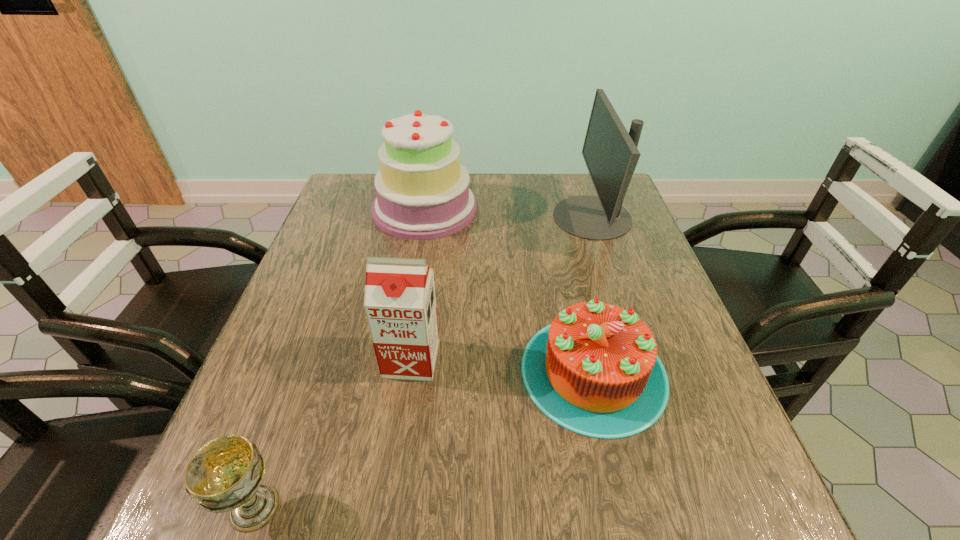
Identify the location of computer monitor. (610, 153).

Locate an element on the screen. The width and height of the screenshot is (960, 540). the farther cake is located at coordinates (422, 190).

At what (x,y) coordinates should I click in order to perform the action: click on the left cake. Please return your answer as a coordinate pair (x, y). Looking at the image, I should click on (422, 190).

I want to click on soya milk, so click(x=400, y=304).

Where is `the right cake`? the right cake is located at coordinates (594, 370).

Identify the location of the nearer cake. (594, 370).

This screenshot has width=960, height=540. Find the location of `vacant space located on the screen of the computer monitor`. vacant space located on the screen of the computer monitor is located at coordinates (531, 217).

Where is `vacant space located 0.200m on the screen of the computer monitor`? This screenshot has height=540, width=960. vacant space located 0.200m on the screen of the computer monitor is located at coordinates (480, 217).

Image resolution: width=960 pixels, height=540 pixels. I want to click on free point located 0.400m on the screen of the computer monitor, so click(407, 217).

Find the location of a particular element. The height and width of the screenshot is (540, 960). vacant space located on the right of the farther cake is located at coordinates (572, 208).